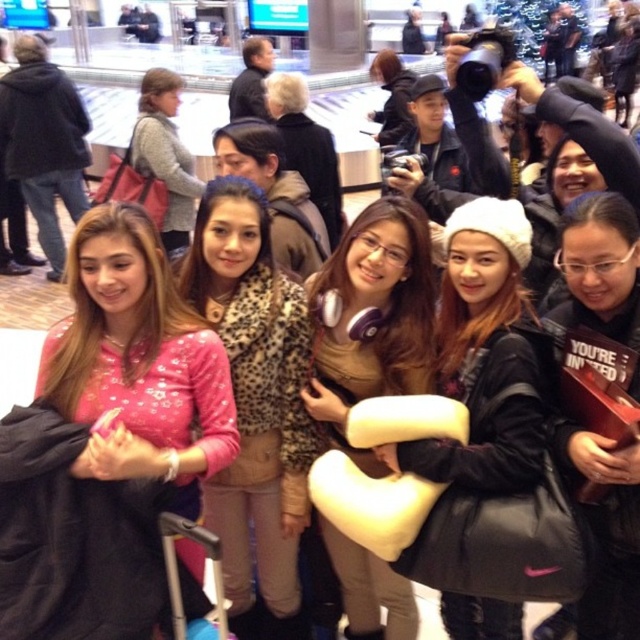
Question: Is black matte jacket at center thinner than gray sweater at center?

Choices:
 (A) yes
 (B) no

Answer: (A)

Question: Which object is positioned closest to the pink satin blouse at center?

Choices:
 (A) matte blue suitcase at lower left
 (B) black matte jacket at center

Answer: (A)

Question: Which object appears farthest from the camera in this image?

Choices:
 (A) black matte jacket at center
 (B) purple matte headphones at center
 (C) matte blue suitcase at lower left
 (D) pink leopard print jacket at center

Answer: (D)

Question: Considering the relative positions of black matte jacket at center and gray sweater at center in the image provided, where is black matte jacket at center located with respect to gray sweater at center?

Choices:
 (A) right
 (B) left

Answer: (A)

Question: Which point is farther from the camera taking this photo?

Choices:
 (A) (586, 596)
 (B) (496, 300)
 (C) (257, 506)
 (D) (177, 572)

Answer: (C)

Question: Is pink satin blouse at center to the right of white matte beanie at center from the viewer's perspective?

Choices:
 (A) yes
 (B) no

Answer: (B)